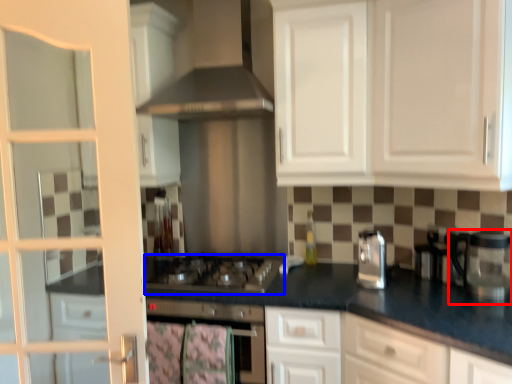
Question: Among these objects, which one is nearest to the camera, coffee machine (highlighted by a red box) or gas stove (highlighted by a blue box)?

Choices:
 (A) coffee machine
 (B) gas stove

Answer: (A)